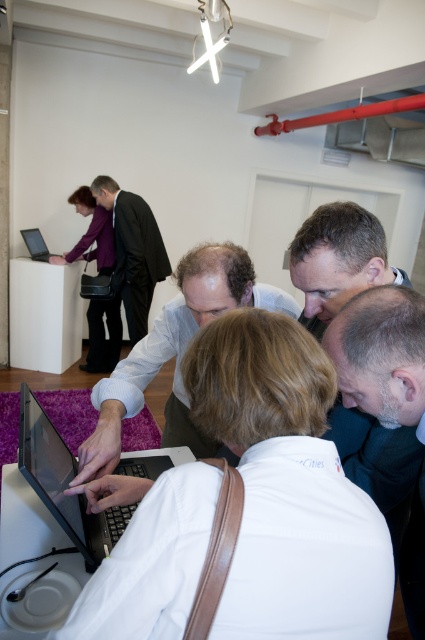
From the picture: You are a photographer in a meeting room trying to capture a clear shot of the light blue shirt at center and the matte black laptop at upper left. Since you want both subjects to be in focus, which object should you prioritize focusing on first, considering their positions?

The light blue shirt at center is positioned on the right side of matte black laptop at upper left. To ensure both are in focus, prioritize focusing on the matte black laptop at upper left as it is closer to the camera, allowing the light blue shirt at center to remain in the depth of field.

You are part of the group around the laptop. You need to identify which object is positioned further to the left between the matte black suit at upper left and the matte black laptop at upper left. Can you determine this based on their positions?

The matte black laptop at upper left is positioned further to the left because the matte black suit at upper left is to its right.

You are a photographer setting up for a group photo. You notice the matte black suit at upper left and the matte black laptop at upper left in the scene. Which object is closer to the bottom of the image?

The matte black suit at upper left is positioned under the matte black laptop at upper left, so the suit is closer to the bottom of the image.